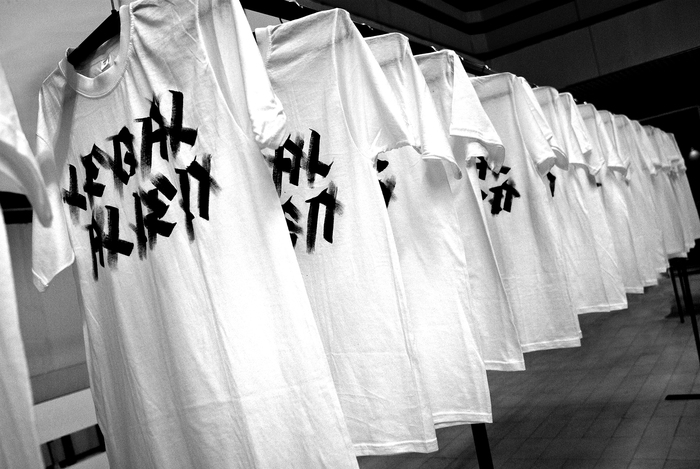
This screenshot has width=700, height=469. I want to click on clothes hanger, so click(x=96, y=31).